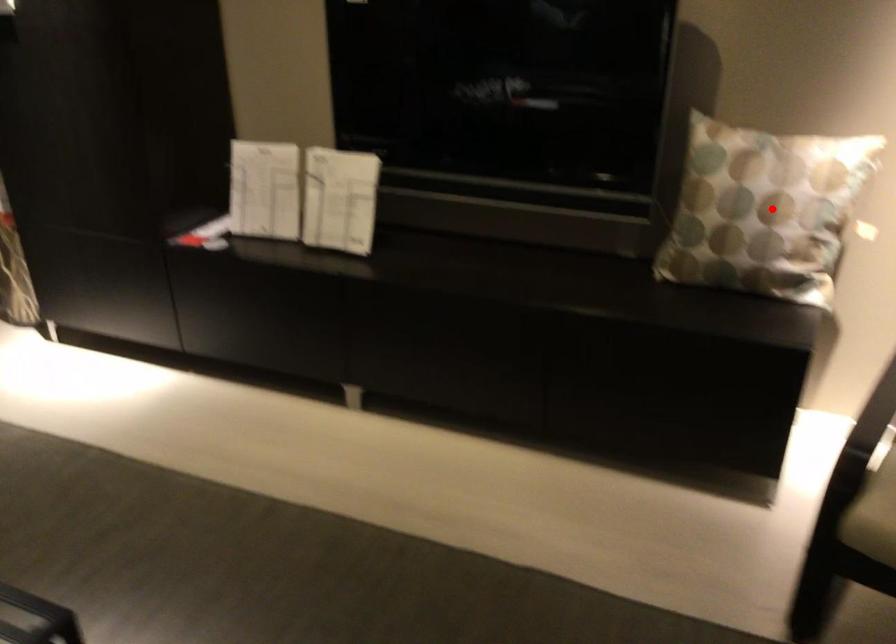
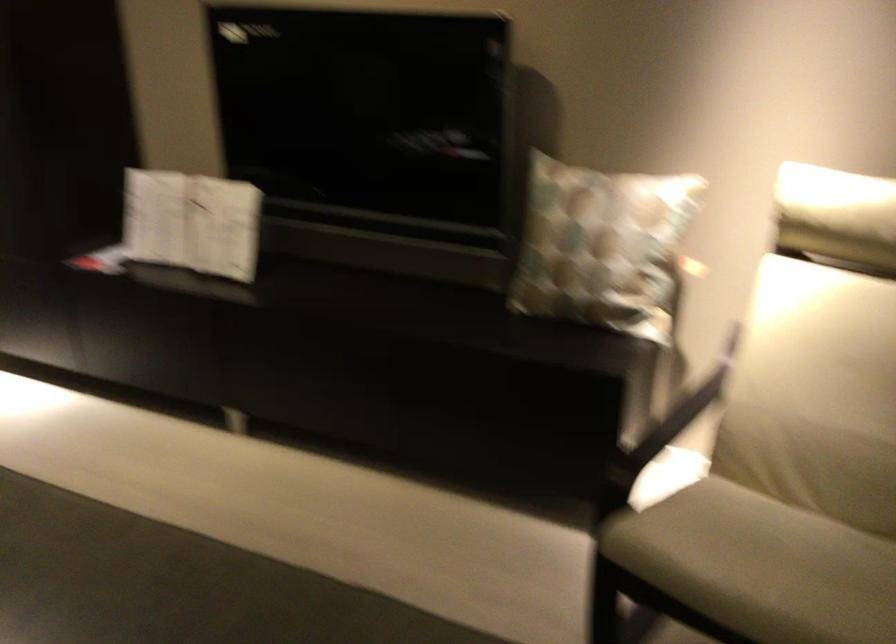
Where in the second image is the point corresponding to the highlighted location from the first image?

(602, 245)